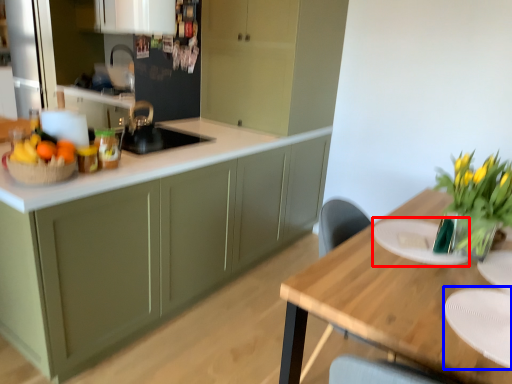
Question: Which of the following is the closest to the observer, plate (highlighted by a red box) or plate (highlighted by a blue box)?

Choices:
 (A) plate
 (B) plate

Answer: (B)